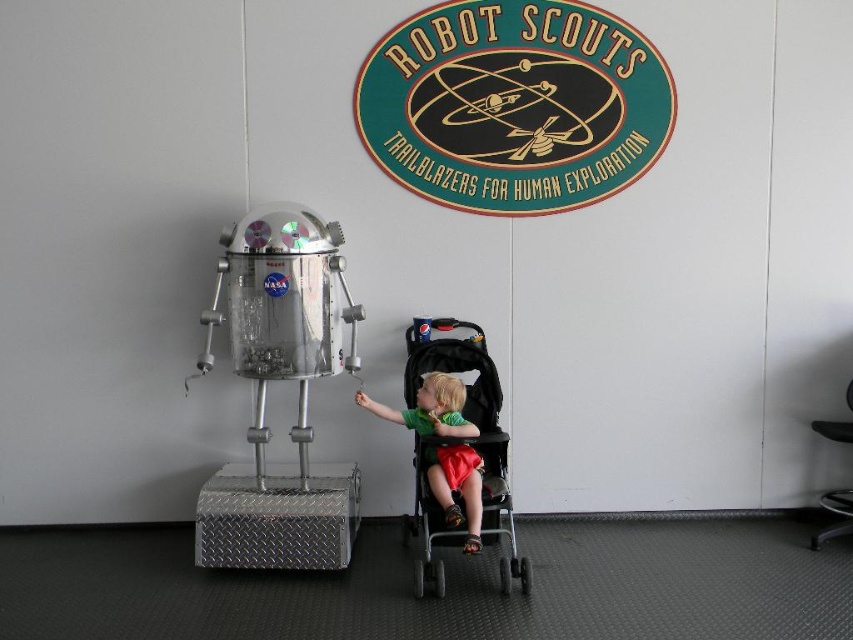
Locate an element on the screen. black fabric stroller at lower center is located at coordinates (477, 428).

Between black fabric stroller at lower center and green fabric shirt at lower center, which one has less height?

With less height is green fabric shirt at lower center.

Between point (426, 529) and point (432, 420), which one is positioned in front?

Positioned in front is point (426, 529).

In order to click on black fabric stroller at lower center in this screenshot , I will do `click(477, 428)`.